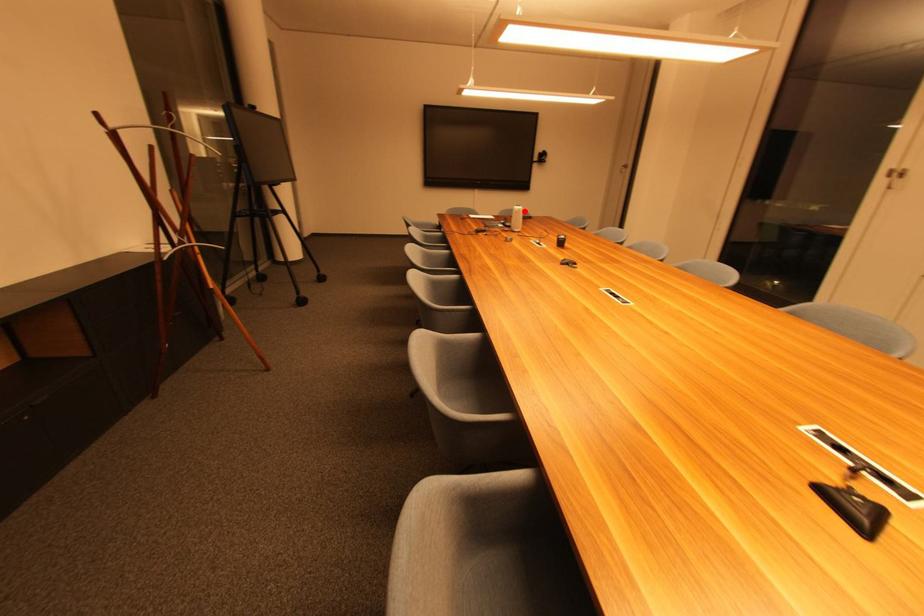
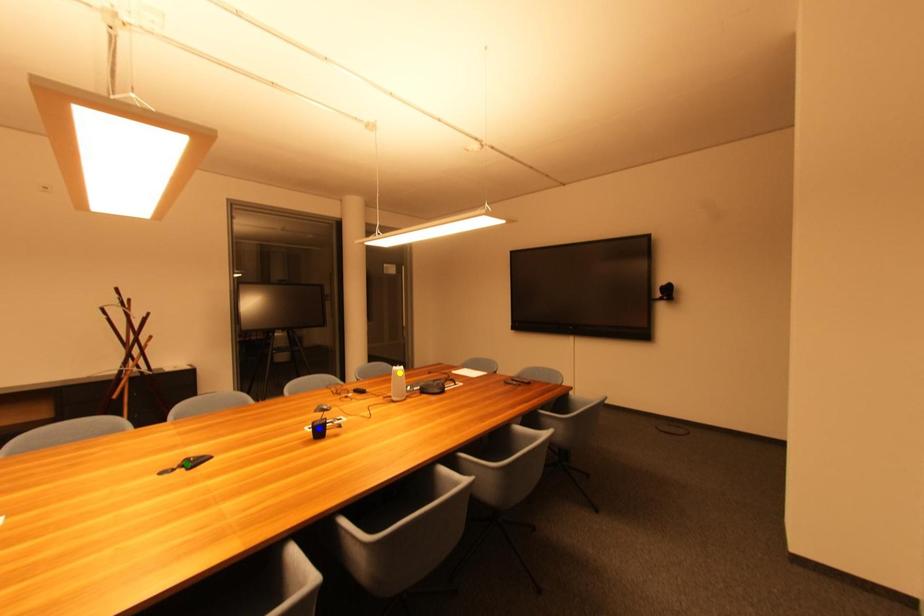
Question: I am providing you with two images of the same scene from different viewpoints. A red point is marked on the first image. You are given multiple points on the second image. Which mark in image 2 goes with the point in image 1?

Choices:
 (A) green point
 (B) yellow point
 (C) blue point

Answer: (B)